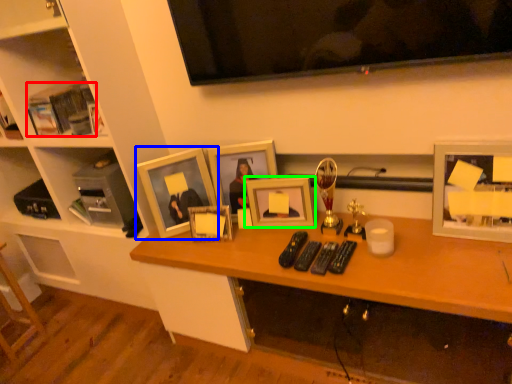
Question: Based on their relative distances, which object is farther from book (highlighted by a red box)? Choose from picture frame (highlighted by a blue box) and picture frame (highlighted by a green box).

Choices:
 (A) picture frame
 (B) picture frame

Answer: (B)